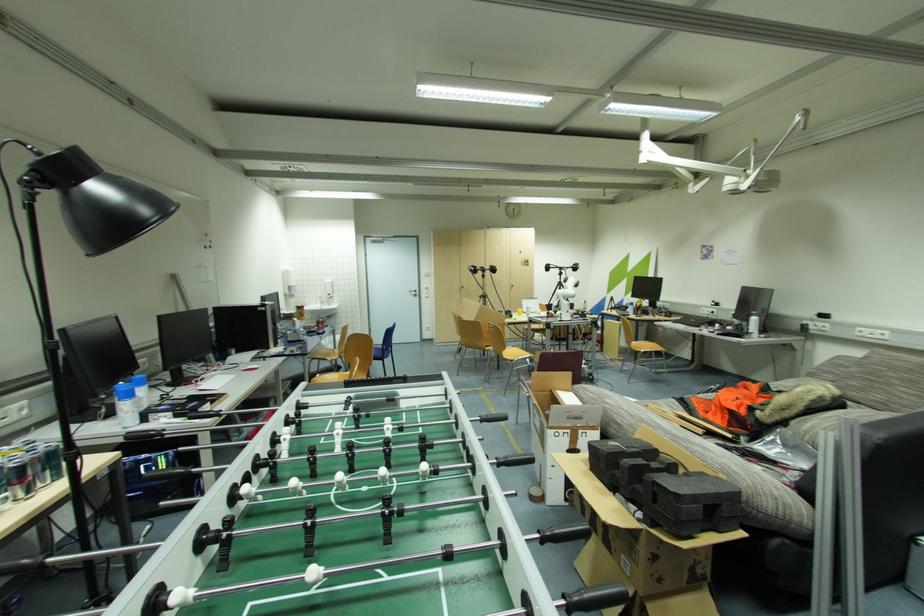
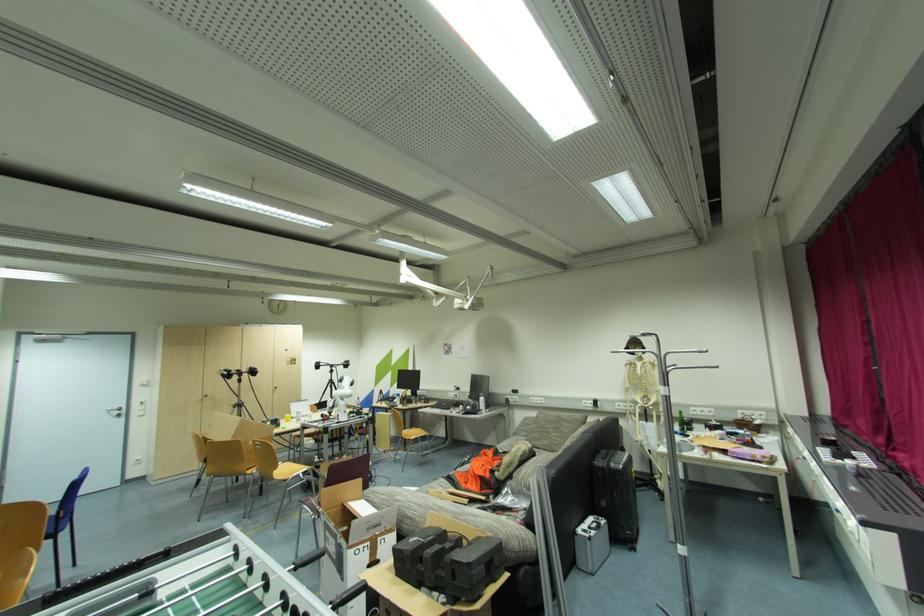
Locate, in the second image, the point that corresponds to point 491,349 in the first image.

(252, 472)